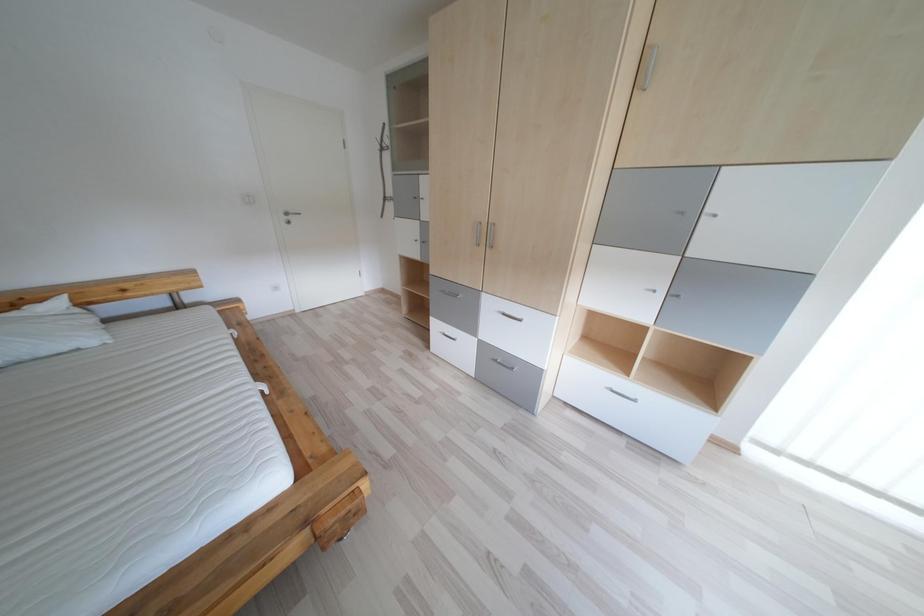
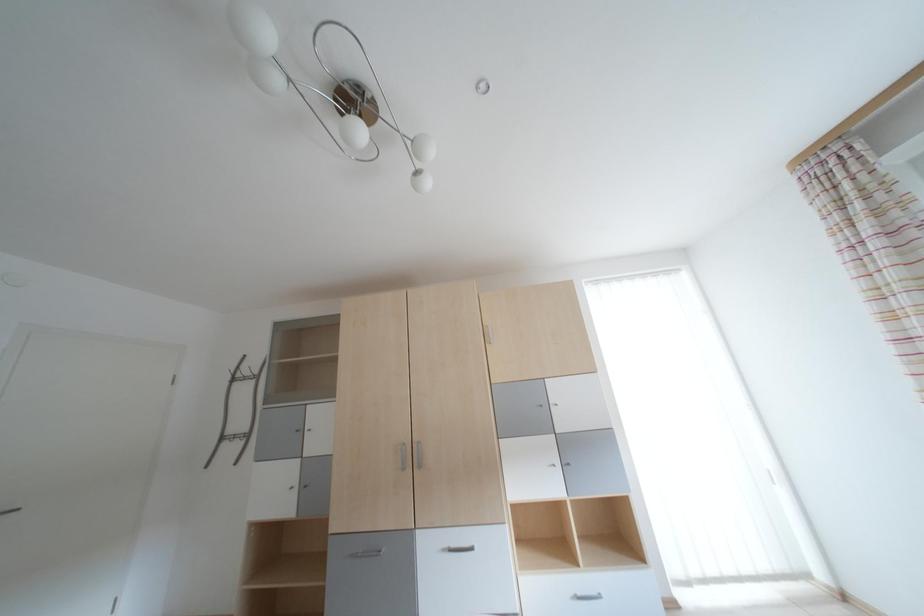
From the picture: The first image is from the beginning of the video and the second image is from the end. How did the camera likely rotate when shooting the video?

The rotation direction of the camera is right-up.